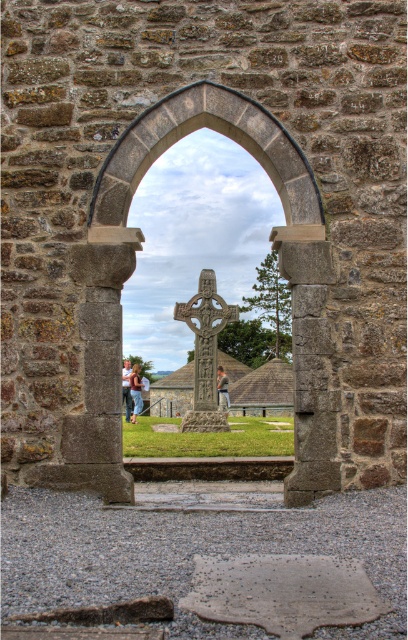
You are standing at the entrance of the stone archway and see two points marked in the scene. Which point is closer to you, point (x=117, y=285) or point (x=135, y=368)?

Point (x=117, y=285) is closer to the viewer than point (x=135, y=368).

You are standing in front of the stone archway and see the gray stone pillar at center and the blurred fabric person at center. Which object is positioned higher in the image?

The gray stone pillar at center is positioned higher than the blurred fabric person at center.